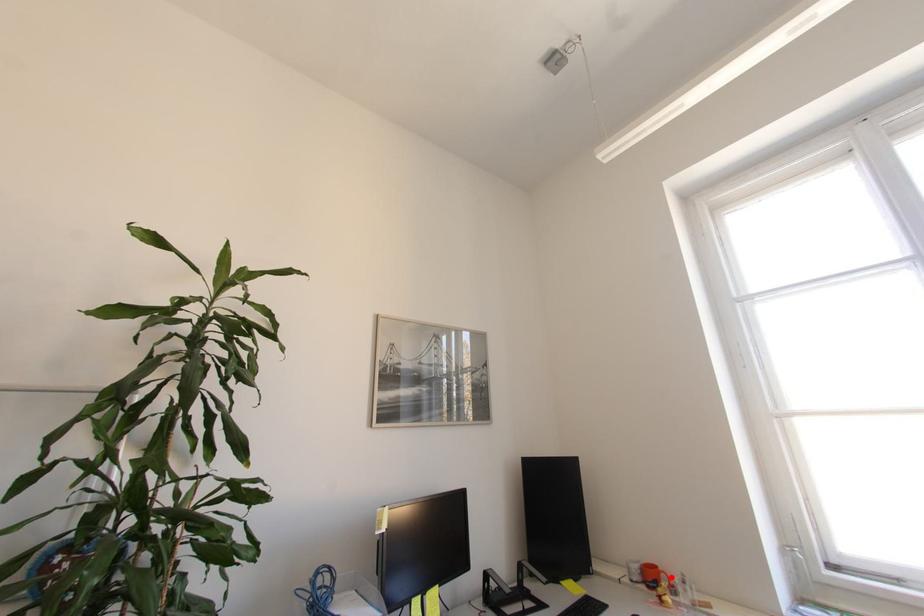
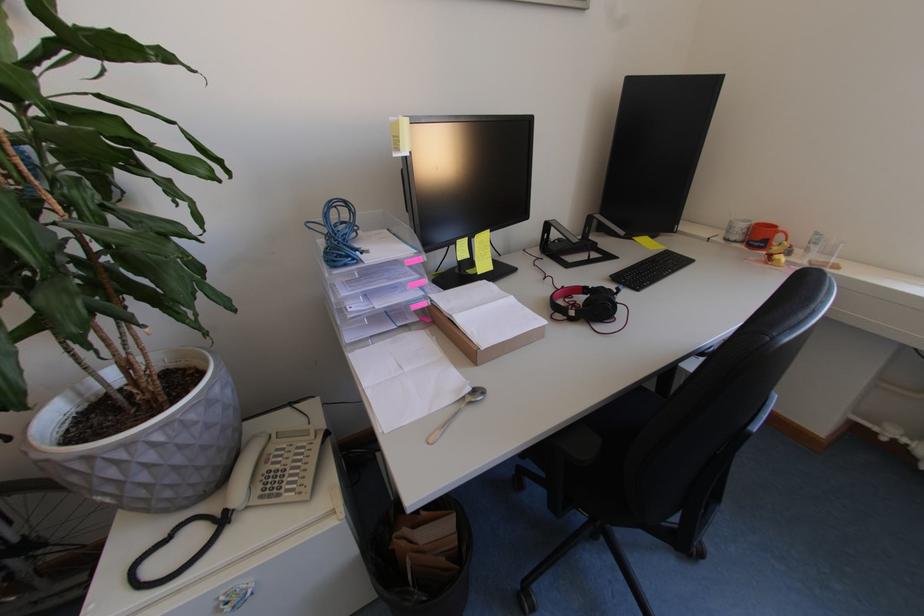
The point at the highlighted location is marked in the first image. Where is the corresponding point in the second image?

(786, 238)